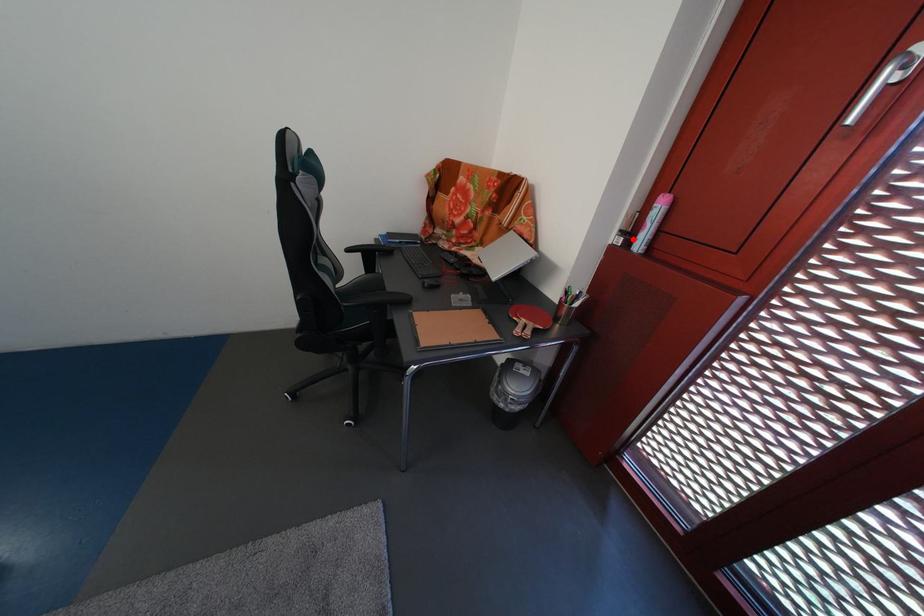
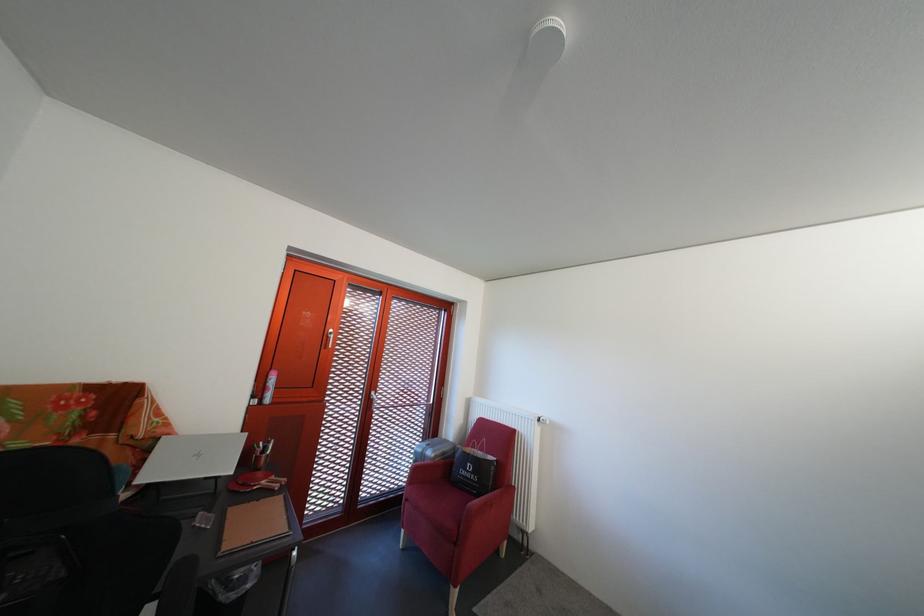
The point at the highlighted location is marked in the first image. Where is the corresponding point in the second image?

(263, 403)